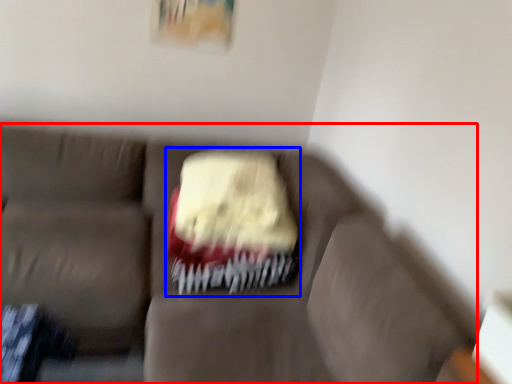
Question: Among these objects, which one is farthest to the camera, studio couch (highlighted by a red box) or cake (highlighted by a blue box)?

Choices:
 (A) studio couch
 (B) cake

Answer: (B)